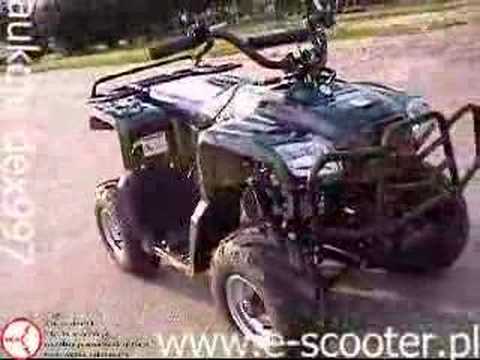
Locate an element on the screen. light is located at coordinates (295, 157), (418, 108), (418, 129).